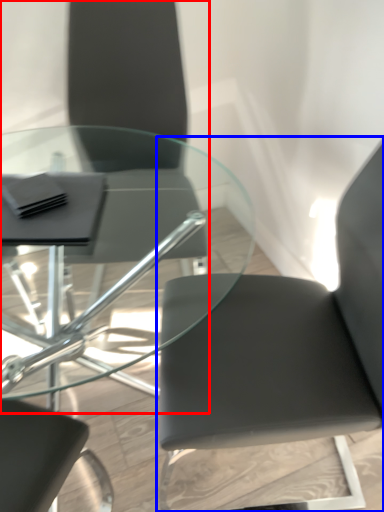
Question: Which object is closer to the camera taking this photo, chair (highlighted by a red box) or chair (highlighted by a blue box)?

Choices:
 (A) chair
 (B) chair

Answer: (B)